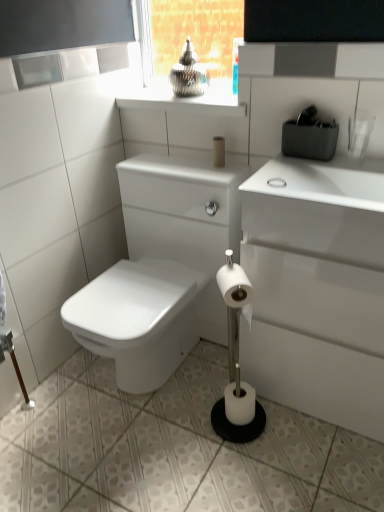
The image size is (384, 512). I want to click on free space on the front side of matte beige toilet paper at center, the third toilet paper in the bottom-to-top sequence, so click(216, 173).